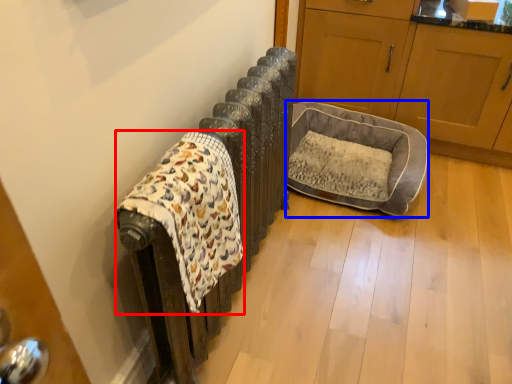
Question: Which point is closer to the camera, blanket (highlighted by a red box) or dog bed (highlighted by a blue box)?

Choices:
 (A) blanket
 (B) dog bed

Answer: (A)